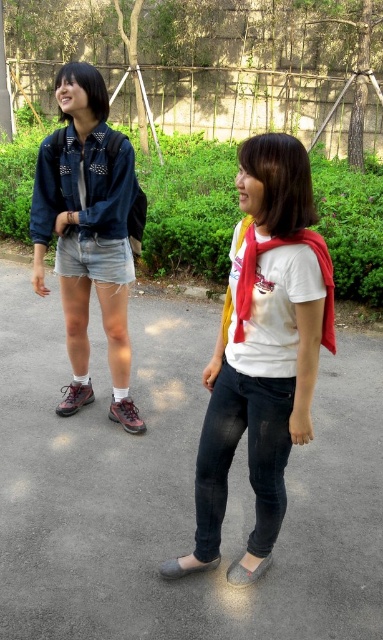
Question: Which is farther from the gray suede sandal at lower center?

Choices:
 (A) denim shorts at left
 (B) denim jeans at center
 (C) gray fabric sandal at lower center

Answer: (A)

Question: Is denim jeans at center bigger than gray fabric sandal at lower center?

Choices:
 (A) no
 (B) yes

Answer: (B)

Question: Among these objects, which one is nearest to the camera?

Choices:
 (A) denim jeans at center
 (B) gray suede sandal at lower center
 (C) gray fabric sandal at lower center

Answer: (A)

Question: Which object is farther from the camera taking this photo?

Choices:
 (A) gray suede sandal at lower center
 (B) gray fabric sandal at lower center

Answer: (A)

Question: Is denim jeans at center bigger than denim shorts at left?

Choices:
 (A) no
 (B) yes

Answer: (A)

Question: Is denim jeans at center positioned before gray fabric sandal at lower center?

Choices:
 (A) no
 (B) yes

Answer: (B)